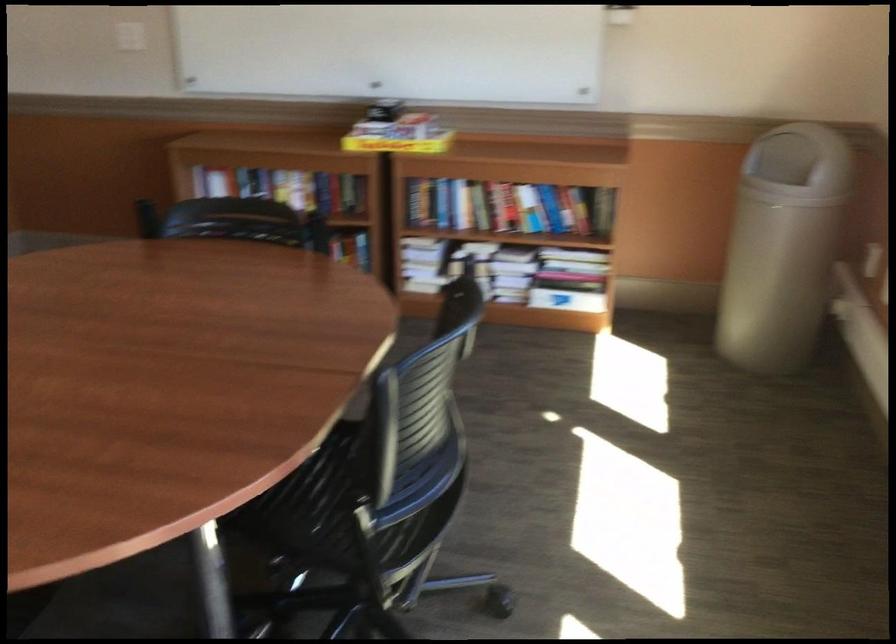
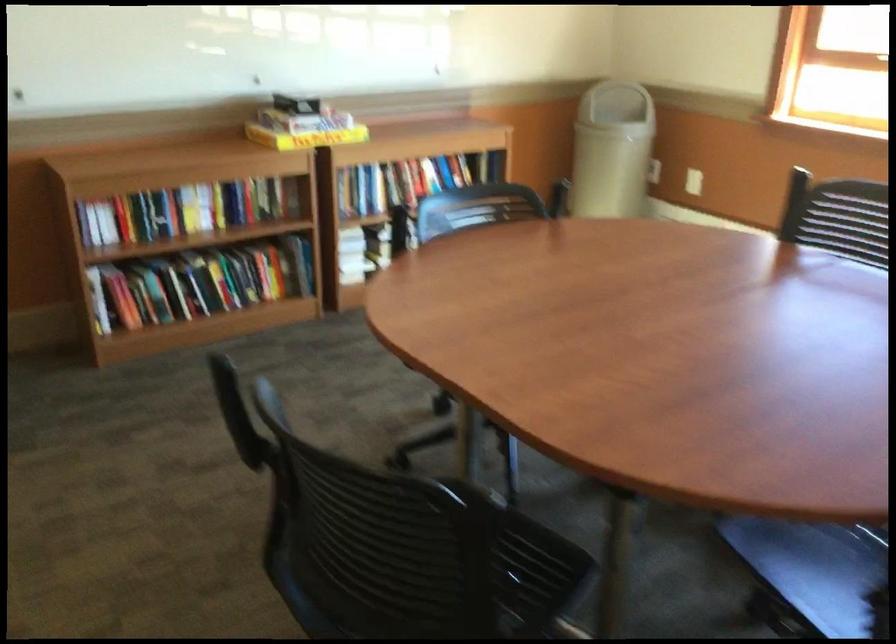
The point at (x=788, y=232) is marked in the first image. Where is the corresponding point in the second image?

(612, 149)